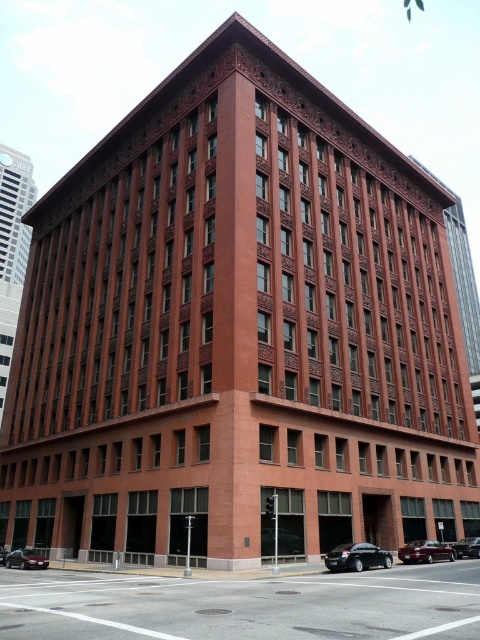
Question: Which point is closer to the camera?

Choices:
 (A) metallic silver car at lower left
 (B) shiny black sedan at lower left
 (C) shiny black sedan at lower center

Answer: (C)

Question: Is shiny black sedan at lower center to the left of metallic silver car at lower left from the viewer's perspective?

Choices:
 (A) no
 (B) yes

Answer: (A)

Question: Which object is the closest to the shiny black sedan at center?

Choices:
 (A) shiny black sedan at lower center
 (B) shiny black sedan at lower left
 (C) metallic silver car at lower left

Answer: (A)

Question: Can you confirm if metallic silver car at lower left is thinner than shiny black sedan at center?

Choices:
 (A) no
 (B) yes

Answer: (A)

Question: Does shiny black sedan at center appear on the left side of shiny black sedan at lower left?

Choices:
 (A) yes
 (B) no

Answer: (B)

Question: Which object appears closest to the camera in this image?

Choices:
 (A) shiny black sedan at lower center
 (B) shiny black sedan at center
 (C) shiny maroon sedan at lower right

Answer: (A)